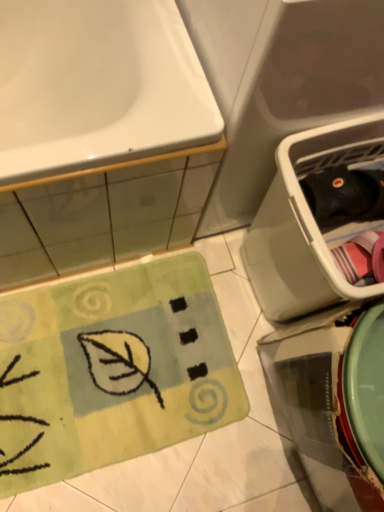
This screenshot has width=384, height=512. In order to click on black plastic dish washer at right in this screenshot , I will do `click(307, 222)`.

Identify the location of black plastic dish washer at right. (307, 222).

Does white glossy sink at upper left have a larger size compared to green plush doormat at lower left?

Yes.

Is white glossy sink at upper left aimed at green plush doormat at lower left?

Yes, white glossy sink at upper left is facing green plush doormat at lower left.

Considering the sizes of white glossy sink at upper left and green plush doormat at lower left in the image, is white glossy sink at upper left wider or thinner than green plush doormat at lower left?

Considering their sizes, white glossy sink at upper left looks broader than green plush doormat at lower left.

In the image, there is a white glossy sink at upper left. At what (x,y) coordinates should I click in order to perform the action: click on doormat below it (from a real-world perspective). Please return your answer as a coordinate pair (x, y). Looking at the image, I should click on (112, 370).

Measure the distance between white glossy sink at upper left and black plastic dish washer at right.

They are 15.37 inches apart.

Consider the image. From the image's perspective, is white glossy sink at upper left above or below black plastic dish washer at right?

Clearly, from the image's perspective, white glossy sink at upper left is above black plastic dish washer at right.

Considering the relative sizes of white glossy sink at upper left and black plastic dish washer at right in the image provided, is white glossy sink at upper left shorter than black plastic dish washer at right?

In fact, white glossy sink at upper left may be taller than black plastic dish washer at right.

Is black plastic dish washer at right located within green plush doormat at lower left?

Definitely not — black plastic dish washer at right is not inside green plush doormat at lower left.

From the image's perspective, does green plush doormat at lower left appear higher than black plastic dish washer at right?

No, from the image's perspective, green plush doormat at lower left is not over black plastic dish washer at right.

Considering the sizes of green plush doormat at lower left and black plastic dish washer at right in the image, is green plush doormat at lower left taller or shorter than black plastic dish washer at right?

green plush doormat at lower left is shorter than black plastic dish washer at right.

Can you see green plush doormat at lower left touching black plastic dish washer at right?

green plush doormat at lower left and black plastic dish washer at right are not in contact.

Is black plastic dish washer at right located outside white glossy sink at upper left?

Yes, black plastic dish washer at right is located beyond the bounds of white glossy sink at upper left.

From the image's perspective, is black plastic dish washer at right located above white glossy sink at upper left?

No, from the image's perspective, black plastic dish washer at right is not over white glossy sink at upper left.

Can you confirm if black plastic dish washer at right is positioned to the left of white glossy sink at upper left?

No.

The width and height of the screenshot is (384, 512). Identify the location of dish washer that appears below the white glossy sink at upper left (from the image's perspective). [307, 222].

Considering the relative positions of green plush doormat at lower left and white glossy sink at upper left in the image provided, is green plush doormat at lower left behind white glossy sink at upper left?

Yes, green plush doormat at lower left is further from the camera.

Can you confirm if green plush doormat at lower left is bigger than white glossy sink at upper left?

Incorrect, green plush doormat at lower left is not larger than white glossy sink at upper left.

Can you confirm if green plush doormat at lower left is thinner than white glossy sink at upper left?

Correct, the width of green plush doormat at lower left is less than that of white glossy sink at upper left.

Is white glossy sink at upper left at the back of green plush doormat at lower left?

Yes, green plush doormat at lower left is positioned with its back facing white glossy sink at upper left.

Does point (274, 320) lie in front of point (232, 399)?

Yes.

Is black plastic dish washer at right shorter than green plush doormat at lower left?

In fact, black plastic dish washer at right may be taller than green plush doormat at lower left.

Can you tell me how much black plastic dish washer at right and green plush doormat at lower left differ in facing direction?

black plastic dish washer at right and green plush doormat at lower left are facing 89.4 degrees away from each other.

Find the location of a particular element. The width and height of the screenshot is (384, 512). doormat that is under the white glossy sink at upper left (from a real-world perspective) is located at coordinates (112, 370).

I want to click on sink located on the left of black plastic dish washer at right, so click(98, 88).

Considering their positions, is black plastic dish washer at right positioned closer to green plush doormat at lower left than white glossy sink at upper left?

The object closer to green plush doormat at lower left is black plastic dish washer at right.

Estimate the real-world distances between objects in this image. Which object is closer to black plastic dish washer at right, white glossy sink at upper left or green plush doormat at lower left?

Among the two, white glossy sink at upper left is located nearer to black plastic dish washer at right.

When comparing their distances from black plastic dish washer at right, does green plush doormat at lower left or white glossy sink at upper left seem further?

The object further to black plastic dish washer at right is green plush doormat at lower left.

Which object lies further to the anchor point white glossy sink at upper left, black plastic dish washer at right or green plush doormat at lower left?

Based on the image, green plush doormat at lower left appears to be further to white glossy sink at upper left.

Which object lies further to the anchor point white glossy sink at upper left, green plush doormat at lower left or black plastic dish washer at right?

green plush doormat at lower left is further to white glossy sink at upper left.

Looking at this image, based on their spatial positions, is white glossy sink at upper left or black plastic dish washer at right closer to green plush doormat at lower left?

black plastic dish washer at right is positioned closer to the anchor green plush doormat at lower left.

Find the location of a particular element. The image size is (384, 512). doormat between white glossy sink at upper left and black plastic dish washer at right in the horizontal direction is located at coordinates (112, 370).